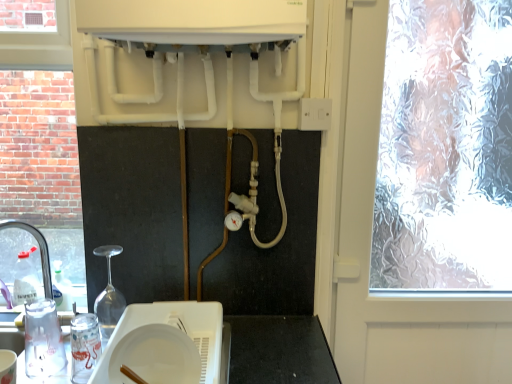
Question: Based on their positions, is white plastic switch at upper right located to the left or right of white plastic plate at lower center, the second appliance in the left-to-right sequence?

Choices:
 (A) right
 (B) left

Answer: (A)

Question: Choose the correct answer: Is white plastic switch at upper right inside white plastic plate at lower center, the second appliance in the left-to-right sequence, or outside it?

Choices:
 (A) inside
 (B) outside

Answer: (B)

Question: Which object is the closest to the clear plastic tap at left?

Choices:
 (A) transparent plastic sink at lower left
 (B) transparent plastic cup at lower left, acting as the first appliance starting from the left
 (C) frosted glass window at right
 (D) white plastic switch at upper right
 (E) white plastic plate at lower center, the second appliance in the left-to-right sequence

Answer: (A)

Question: Considering the real-world distances, which object is farthest from the white matte plate at center?

Choices:
 (A) white plastic plate at lower center, the second appliance in the left-to-right sequence
 (B) transparent plastic cup at lower left, the second appliance from the right
 (C) frosted glass window at right
 (D) white plastic switch at upper right
 (E) transparent plastic sink at lower left

Answer: (C)